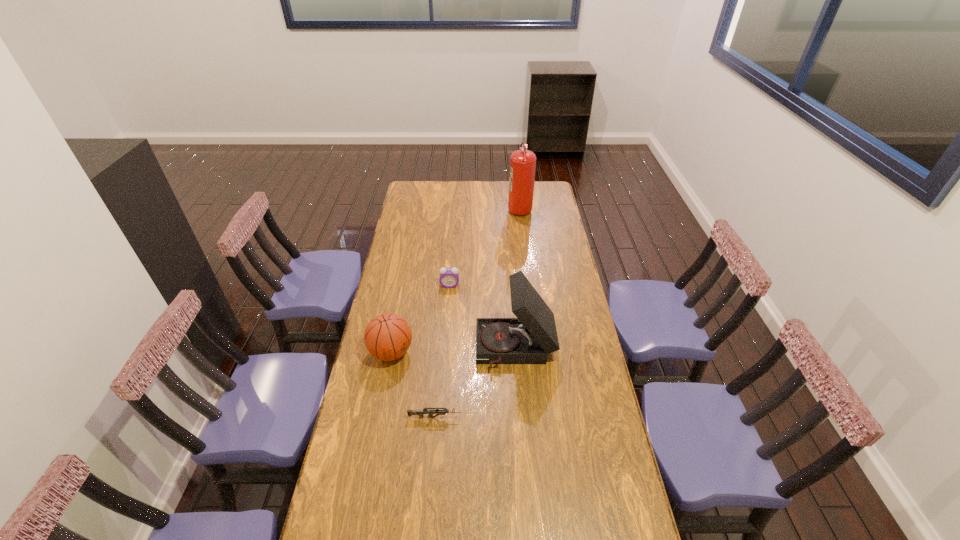
The width and height of the screenshot is (960, 540). In order to click on fire extinguisher that is positioned at the right edge in this screenshot , I will do `click(523, 162)`.

Locate an element on the screen. The width and height of the screenshot is (960, 540). phonograph_record situated at the right edge is located at coordinates (528, 339).

Where is `object present at the far right corner`? object present at the far right corner is located at coordinates (523, 162).

This screenshot has height=540, width=960. In the image, there is a desktop. Find the location of `vacant region at the far edge`. vacant region at the far edge is located at coordinates (444, 191).

Identify the location of vacant space at the left edge of the desktop. (405, 224).

In the image, there is a desktop. At what (x,y) coordinates should I click in order to perform the action: click on free space at the right edge. Please return your answer as a coordinate pair (x, y). This screenshot has height=540, width=960. Looking at the image, I should click on (570, 330).

Where is `vacant area at the far right corner of the desktop`? This screenshot has height=540, width=960. vacant area at the far right corner of the desktop is located at coordinates (536, 186).

Identify the location of free space between the nearest object and the second shortest object. (443, 352).

Where is `free point between the basketball and the phonograph_record`? free point between the basketball and the phonograph_record is located at coordinates (453, 352).

This screenshot has width=960, height=540. Identify the location of vacant area that lies between the alarm clock and the basketball. (420, 319).